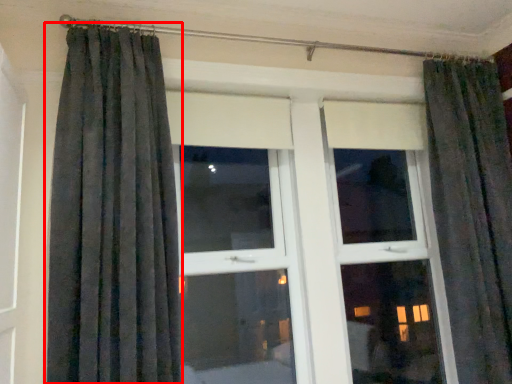
Question: From the image's perspective, what is the correct spatial relationship of curtain (annotated by the red box) in relation to bay window?

Choices:
 (A) below
 (B) above

Answer: (B)